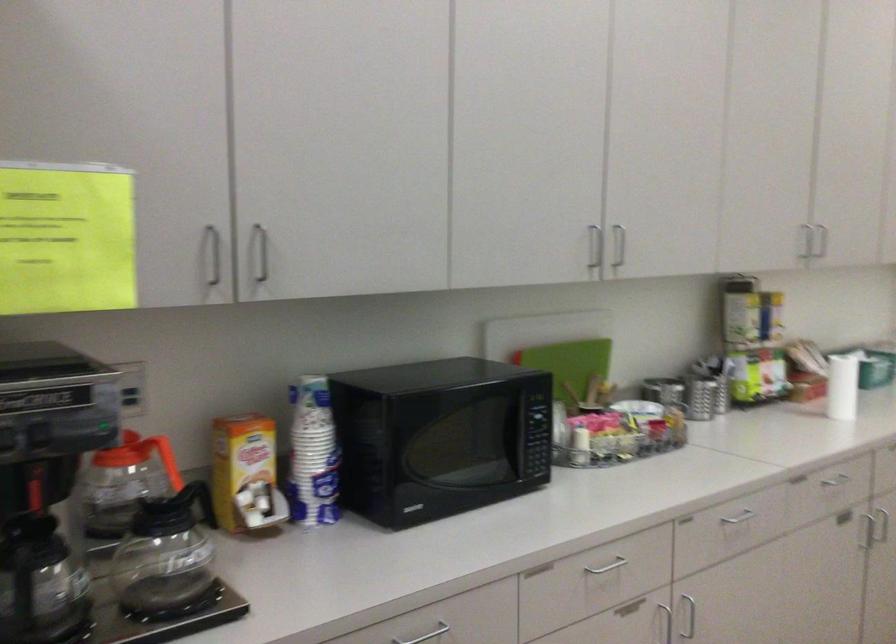
The image size is (896, 644). What do you see at coordinates (440, 437) in the screenshot? I see `the microwave door handle` at bounding box center [440, 437].